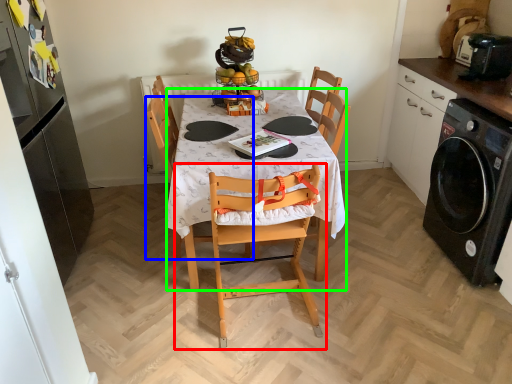
Question: Which is farther away from chair (highlighted by a red box)? chair (highlighted by a blue box) or desk (highlighted by a green box)?

Choices:
 (A) chair
 (B) desk

Answer: (A)